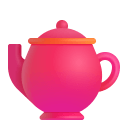
Where is `handle`? Image resolution: width=128 pixels, height=128 pixels. handle is located at coordinates (116, 65).